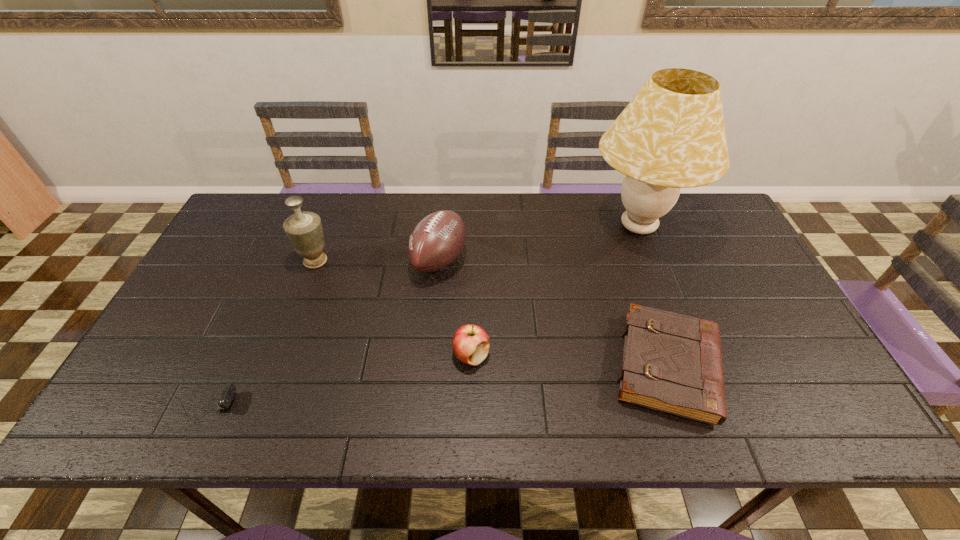
Locate an element on the screen. The image size is (960, 540). the tallest object is located at coordinates (671, 135).

Image resolution: width=960 pixels, height=540 pixels. What are the coordinates of `urn` in the screenshot? It's located at (304, 230).

In order to click on the fifth shortest object in this screenshot , I will do `click(304, 230)`.

I want to click on football (American), so click(x=436, y=241).

Locate an element on the screen. the fourth tallest object is located at coordinates (470, 343).

Identify the location of hardback book. (672, 363).

Identify the location of the leftmost object. (229, 390).

Image resolution: width=960 pixels, height=540 pixels. What are the coordinates of `webcam` in the screenshot? It's located at (229, 390).

This screenshot has height=540, width=960. I want to click on vacant region located on the left of the lampshade, so click(463, 227).

Locate an element on the screen. vacant space situated on the right of the urn is located at coordinates (420, 261).